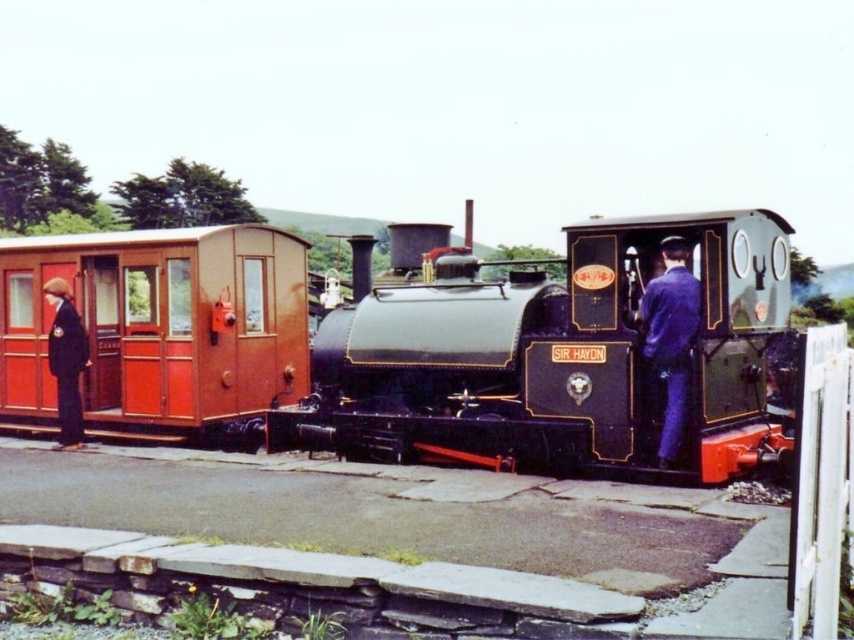
You are a visitor at the railway station and notice the polished black locomotive at center and the blue fabric uniform at center. Which object is closer to you?

The blue fabric uniform at center is closer to you because the polished black locomotive at center is positioned over it, indicating it is behind and thus farther away.

You are standing at point A located at coordinates 0.6, 0.5. You want to move to the polished black locomotive at center. Which direction should you move in?

Since you are at coordinates (427, 384) and the polished black locomotive at center is at (423, 353), you should move slightly to the left and down to reach it.

You are a photographer standing at the point labeled point (x=423, y=353). You want to take a photo of the red and cream passenger carriage to the left of the locomotive. Will you be able to see the entire carriage in your photo if your camera has a 90 degree field of view?

The point (x=423, y=353) is on the polished black locomotive at center, so you are standing on the locomotive. Since the red and cream passenger carriage is to the left of the locomotive, your position on the locomotive might block part of the carriage from view. However, with a 90 degree field of view, you could potentially capture the entire carriage if positioned correctly, but this depends on the exact distance and angle. Without specific measurements, it is uncertain.